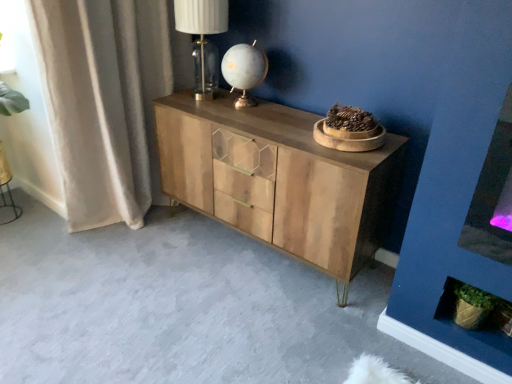
The height and width of the screenshot is (384, 512). I want to click on free space in front of natural wood cabinet at center, so click(260, 346).